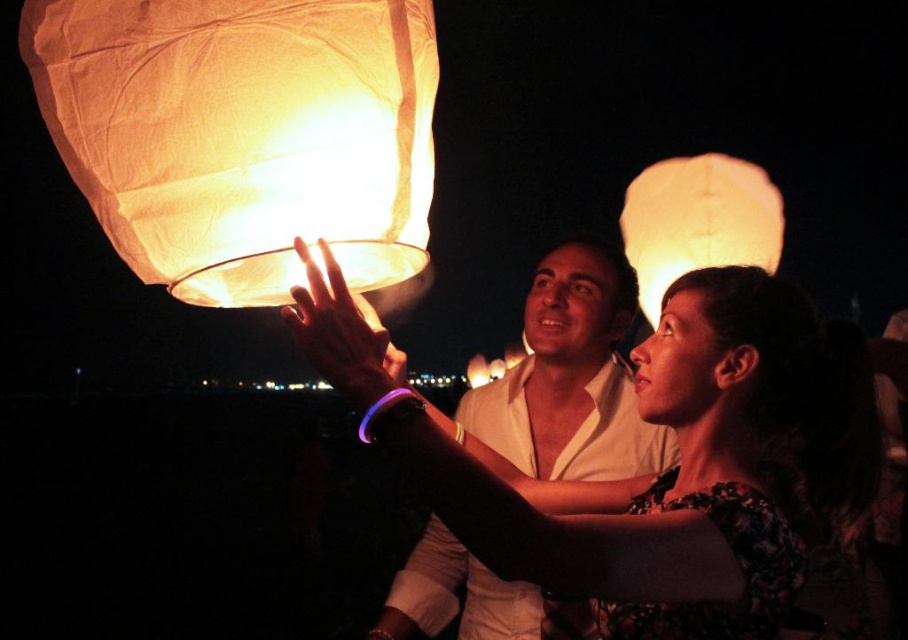
Question: Is matte white shirt at center above matte white lantern at upper right?

Choices:
 (A) no
 (B) yes

Answer: (A)

Question: Does matte paper lantern at upper left have a lesser width compared to matte white shirt at center?

Choices:
 (A) no
 (B) yes

Answer: (B)

Question: Which object appears closest to the camera in this image?

Choices:
 (A) matte white shirt at center
 (B) matte white lantern at upper right
 (C) matte paper lantern at upper left

Answer: (C)

Question: Which point is farther to the camera?

Choices:
 (A) matte paper lantern at upper left
 (B) matte white shirt at center

Answer: (B)

Question: Estimate the real-world distances between objects in this image. Which object is farther from the matte white lantern at upper right?

Choices:
 (A) matte white shirt at center
 (B) matte paper lantern at upper left

Answer: (B)

Question: Considering the relative positions of matte white shirt at center and matte white lantern at upper right in the image provided, where is matte white shirt at center located with respect to matte white lantern at upper right?

Choices:
 (A) above
 (B) below

Answer: (B)